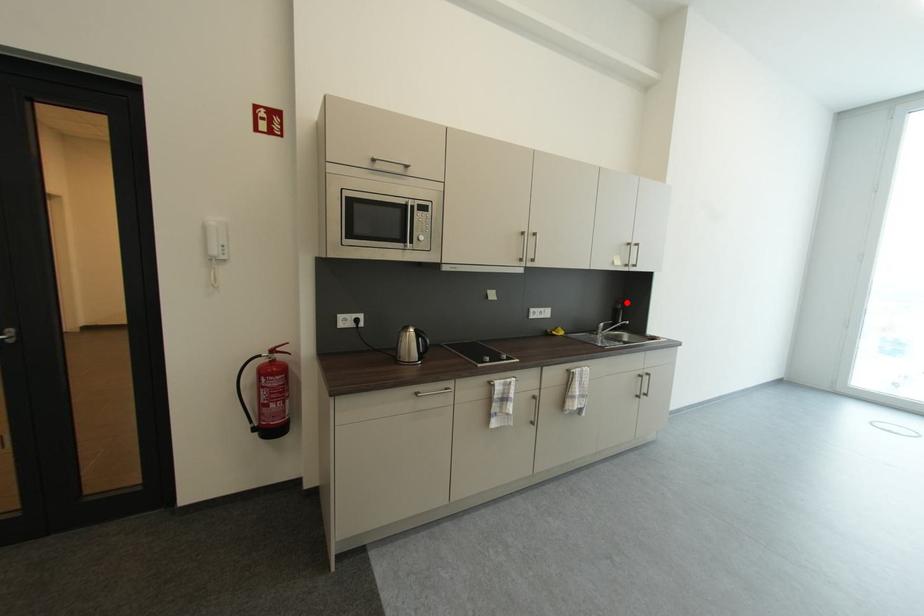
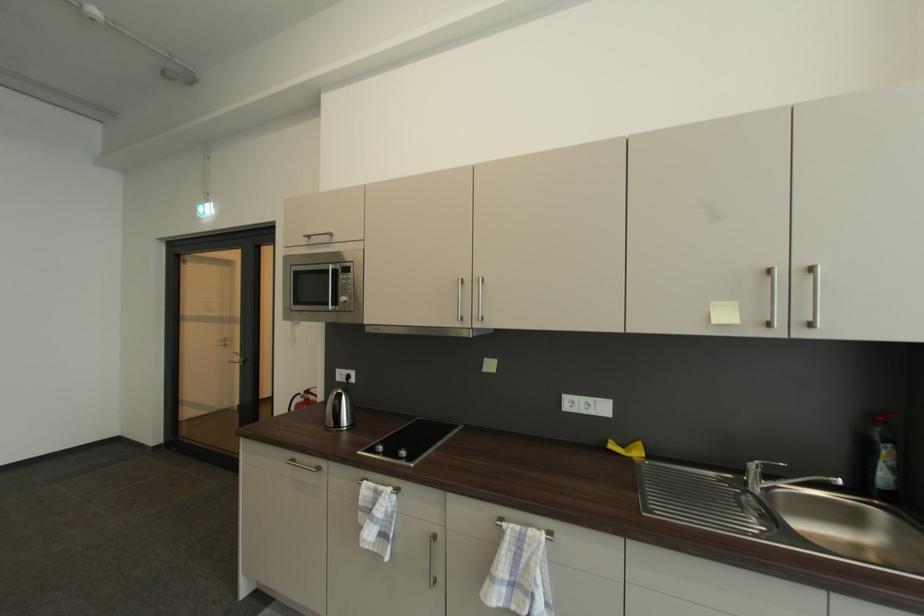
The point at the highlighted location is marked in the first image. Where is the corresponding point in the second image?

(885, 419)